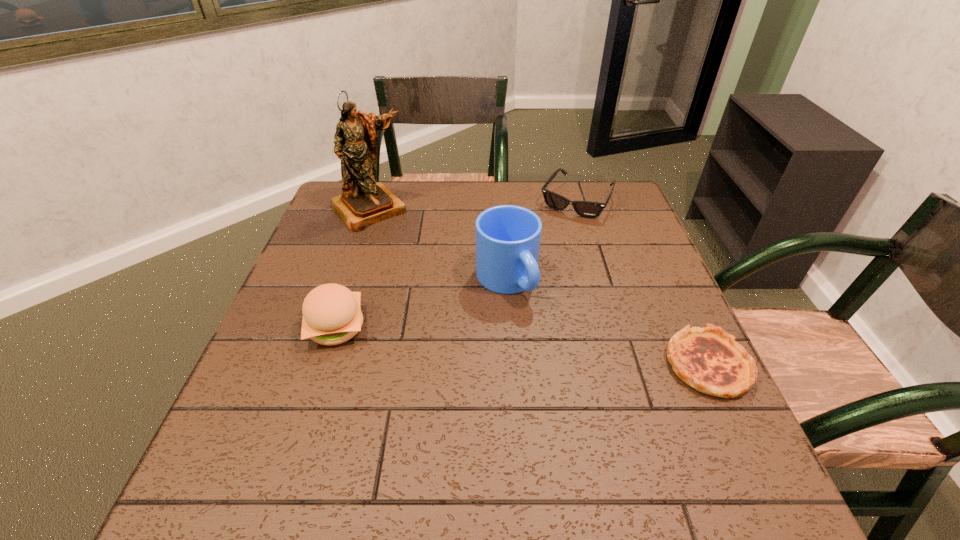
Locate an element on the screen. This screenshot has height=540, width=960. figurine present at the left edge is located at coordinates (364, 202).

This screenshot has width=960, height=540. I want to click on quiche that is positioned at the right edge, so click(708, 359).

Where is `sunglasses that is at the right edge`? The width and height of the screenshot is (960, 540). sunglasses that is at the right edge is located at coordinates (587, 209).

The image size is (960, 540). Find the location of `object situated at the far left corner`. object situated at the far left corner is located at coordinates (364, 202).

The image size is (960, 540). What are the coordinates of `object located at the far right corner` in the screenshot? It's located at (587, 209).

Where is `vacant space at the far edge`? The width and height of the screenshot is (960, 540). vacant space at the far edge is located at coordinates (536, 183).

Identify the location of free space at the left edge of the desktop. This screenshot has width=960, height=540. (299, 391).

This screenshot has width=960, height=540. In the image, there is a desktop. Identify the location of vacant space at the far right corner. (587, 197).

Where is `vacant area at the near right corner of the desktop`? vacant area at the near right corner of the desktop is located at coordinates (660, 437).

Where is `blank region between the third shortest object and the shortest object`? The height and width of the screenshot is (540, 960). blank region between the third shortest object and the shortest object is located at coordinates (522, 346).